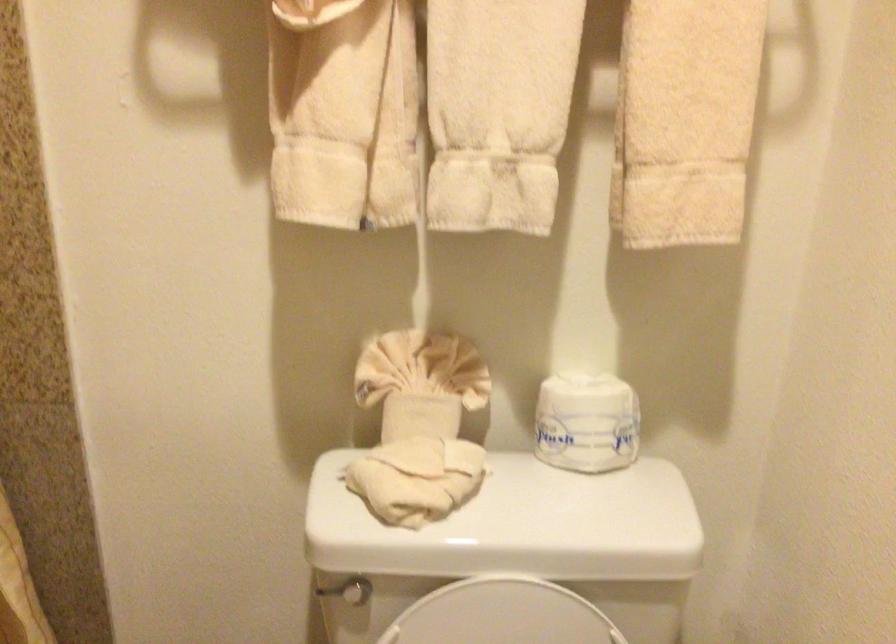
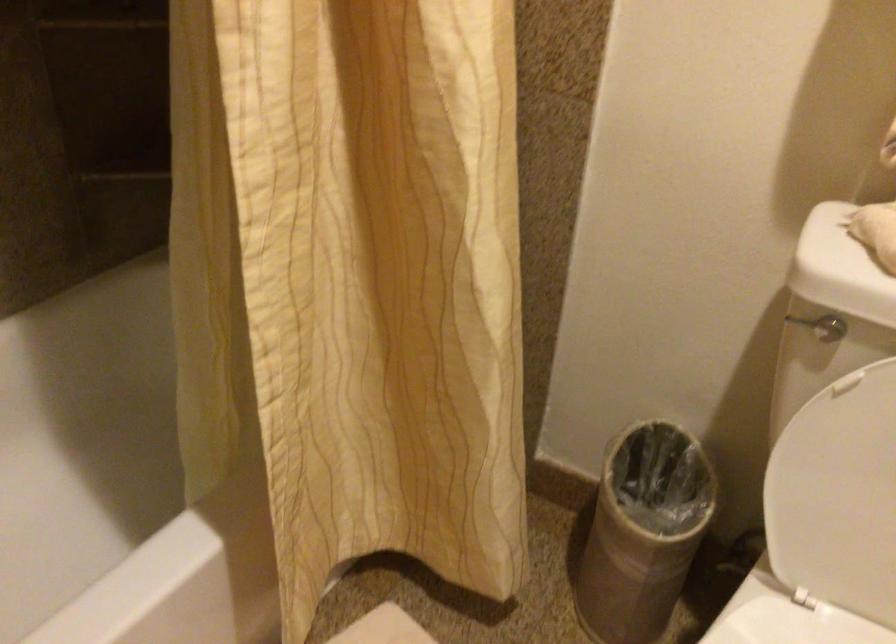
Based on the continuous images, in which direction is the camera rotating?

The camera's rotation is toward left-down.